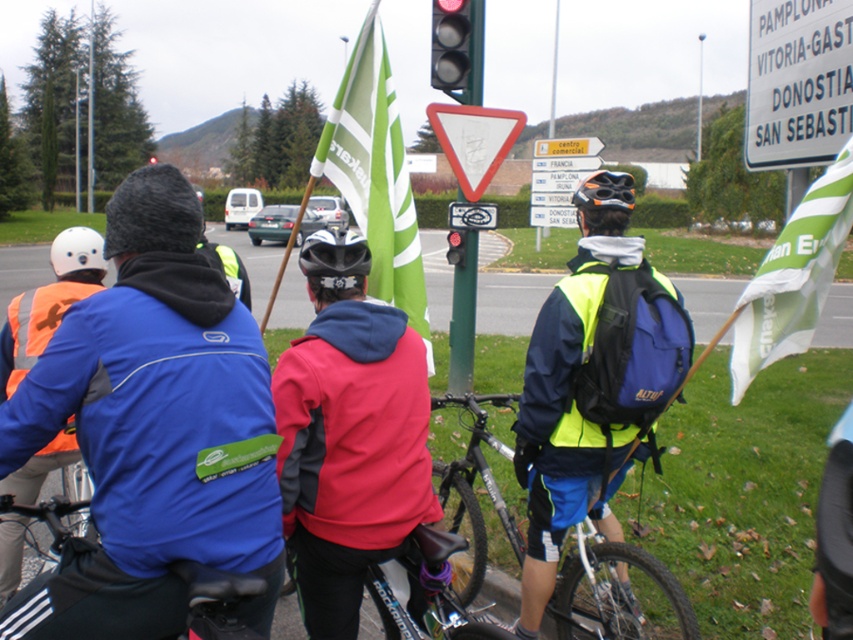
Is point (357, 140) positioned in front of point (462, 22)?

That is True.

Is green fabric flag at center wider than red glass traffic light at upper center?

Yes, green fabric flag at center is wider than red glass traffic light at upper center.

Is point (361, 195) closer to viewer compared to point (456, 44)?

Yes, it is.

Where is `green fabric flag at center`? Image resolution: width=853 pixels, height=640 pixels. green fabric flag at center is located at coordinates (375, 172).

How far apart are white plastic sign at upper right and black matte helmet at center?

A distance of 3.32 meters exists between white plastic sign at upper right and black matte helmet at center.

Which is in front, point (840, 45) or point (326, 237)?

Point (326, 237) is more forward.

Where is `white plastic sign at upper right`? Image resolution: width=853 pixels, height=640 pixels. white plastic sign at upper right is located at coordinates (798, 83).

Measure the distance between red glass traffic light at upper center and camera.

They are 7.61 meters apart.

Is red glass traffic light at upper center wider than white plastic road sign at upper center?

Correct, the width of red glass traffic light at upper center exceeds that of white plastic road sign at upper center.

Which is in front, point (454, 56) or point (552, 170)?

Point (454, 56) is in front.

Locate an element on the screen. Image resolution: width=853 pixels, height=640 pixels. red glass traffic light at upper center is located at coordinates (450, 45).